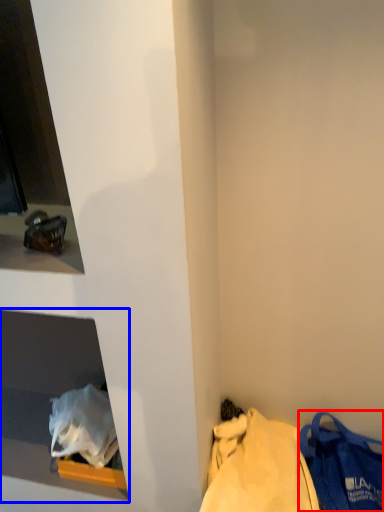
Question: Which of the following is the closest to the observer, handbag (highlighted by a red box) or cabinet (highlighted by a blue box)?

Choices:
 (A) handbag
 (B) cabinet

Answer: (A)